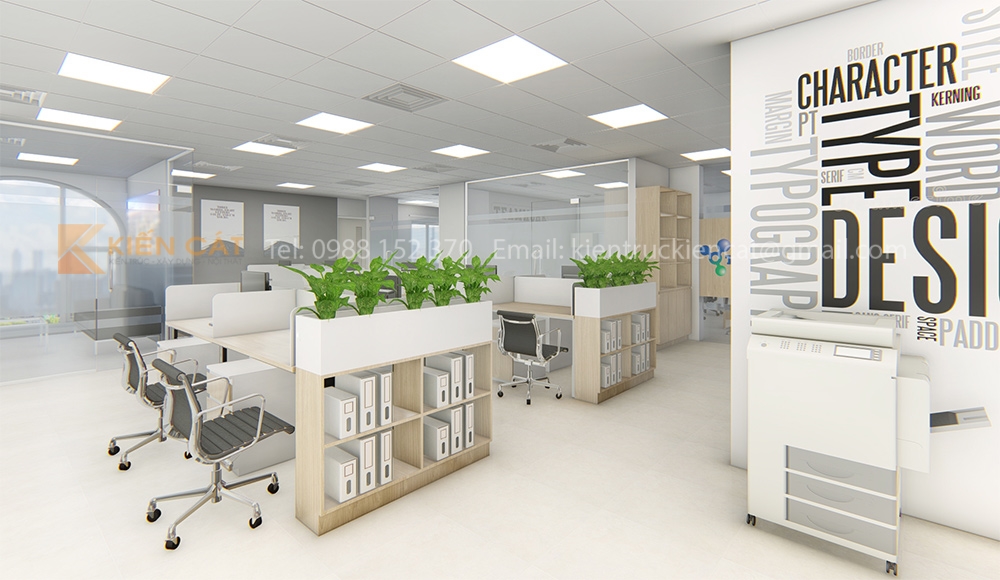
I want to click on window, so click(27, 246), click(91, 228), click(96, 257), click(430, 232), click(414, 233), click(180, 212).